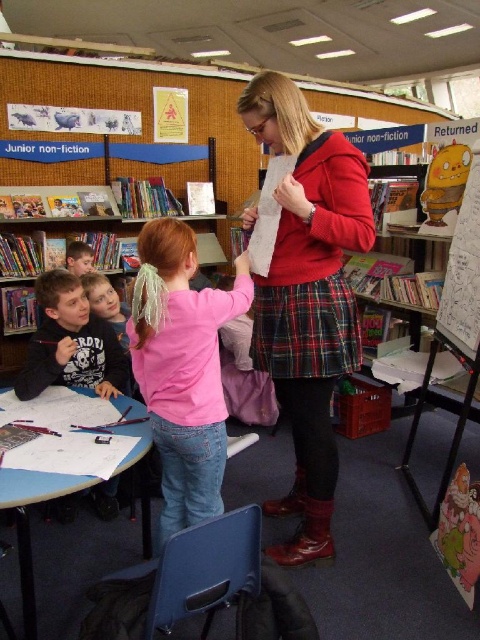
Is pink matte shirt at center smaller than cartoon paperboard at right?

Incorrect, pink matte shirt at center is not smaller in size than cartoon paperboard at right.

What are the coordinates of `pink matte shirt at center` in the screenshot? It's located at pyautogui.click(x=182, y=369).

This screenshot has width=480, height=640. I want to click on pink matte shirt at center, so click(x=182, y=369).

Is point (283, 240) closer to camera compared to point (471, 243)?

Yes, point (283, 240) is closer to viewer.

Is red plaid skirt at center to the right of cartoon paperboard at right from the viewer's perspective?

No, red plaid skirt at center is not to the right of cartoon paperboard at right.

Where is `red plaid skirt at center`? red plaid skirt at center is located at coordinates (308, 296).

Identify the location of red plaid skirt at center. (308, 296).

Between point (322, 225) and point (38, 285), which one is positioned in front?

Point (322, 225) is more forward.

Does red plaid skirt at center appear on the left side of matte black shirt at left?

Incorrect, red plaid skirt at center is not on the left side of matte black shirt at left.

Who is more distant from viewer, (290, 93) or (55, 275)?

Point (55, 275)

Find the location of a particular element. Image resolution: width=480 pixels, height=640 pixels. red plaid skirt at center is located at coordinates (308, 296).